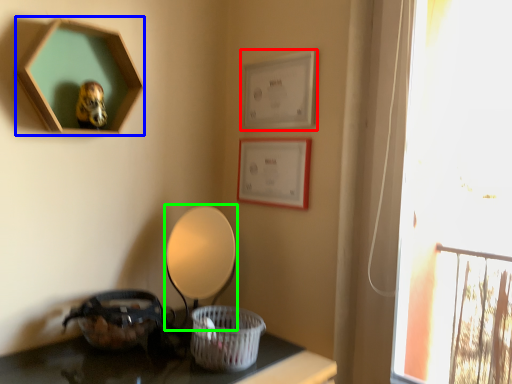
Question: Which object is positioned closest to picture frame (highlighted by a red box)? Select from picture frame (highlighted by a blue box) and table lamp (highlighted by a green box).

Choices:
 (A) picture frame
 (B) table lamp

Answer: (B)